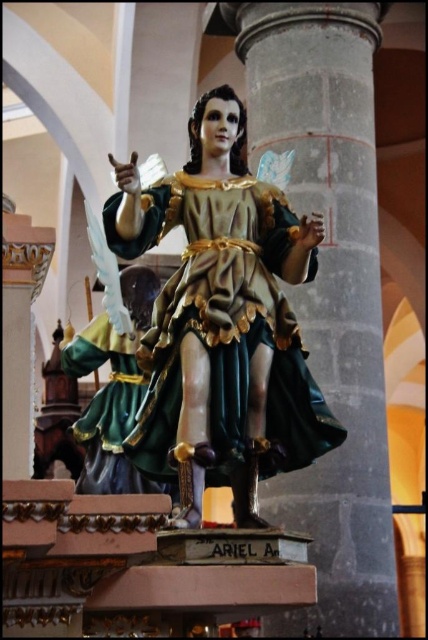
Question: Which object is farther from the camera taking this photo?

Choices:
 (A) polychrome wood statue at center
 (B) gray stone column at center

Answer: (B)

Question: Which of the following is the closest to the observer?

Choices:
 (A) (166, 301)
 (B) (348, 212)

Answer: (A)

Question: In this image, where is gray stone column at center located relative to polychrome wood statue at center?

Choices:
 (A) below
 (B) above

Answer: (B)

Question: In this image, where is gray stone column at center located relative to polychrome wood statue at center?

Choices:
 (A) left
 (B) right

Answer: (B)

Question: Does gray stone column at center have a lesser width compared to polychrome wood statue at center?

Choices:
 (A) no
 (B) yes

Answer: (A)

Question: Which point appears farthest from the camera in this image?

Choices:
 (A) (335, 401)
 (B) (160, 292)

Answer: (A)